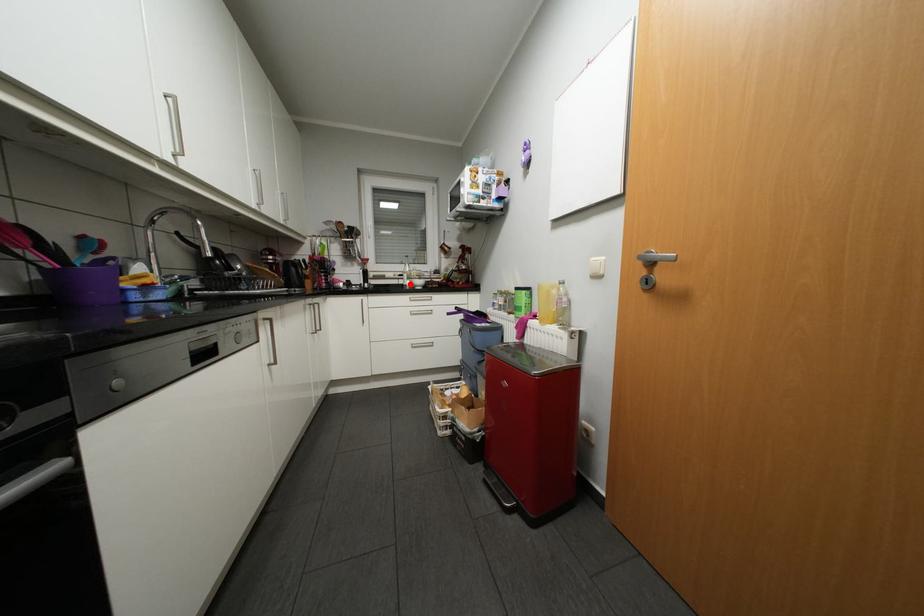
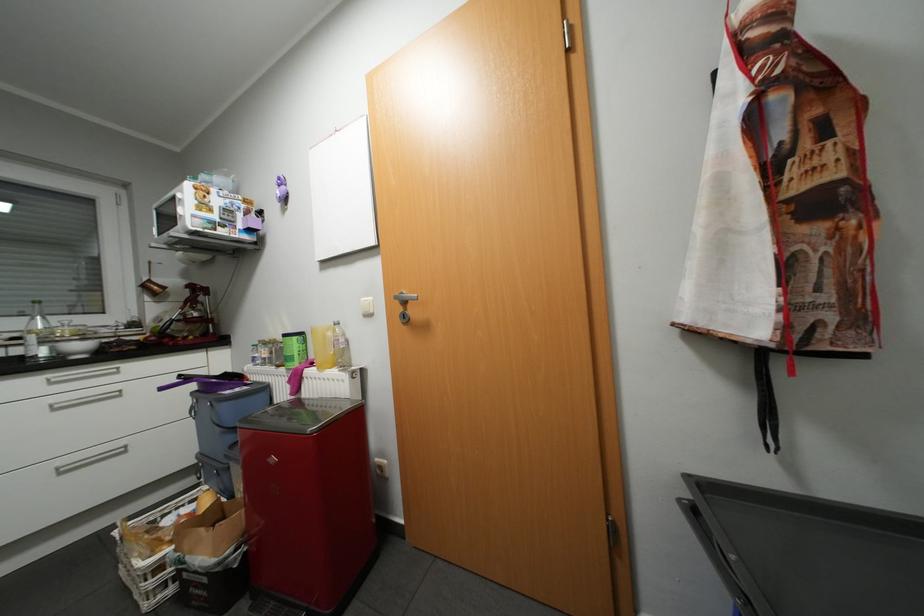
In the second image, find the point that corresponds to the highlighted location in the first image.

(30, 357)